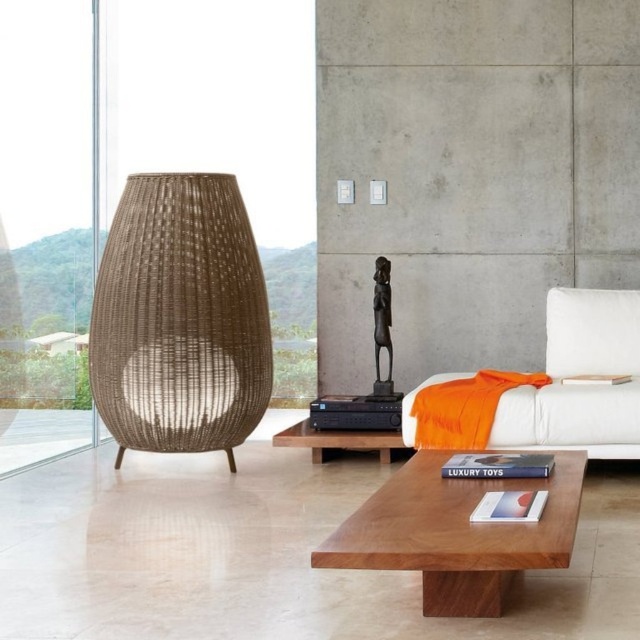
Does transparent glass door at left come behind brown wooden table at center?

Yes, transparent glass door at left is behind brown wooden table at center.

Is transparent glass door at left to the right of brown wooden table at center from the viewer's perspective?

Incorrect, transparent glass door at left is not on the right side of brown wooden table at center.

What do you see at coordinates (45, 225) in the screenshot? This screenshot has height=640, width=640. I see `transparent glass door at left` at bounding box center [45, 225].

Find the location of `transparent glass door at left`. transparent glass door at left is located at coordinates (45, 225).

Is white fabric couch at right shorter than brown woven side table at center?

No.

Is white fabric couch at right positioned at the back of brown woven side table at center?

No, it is in front of brown woven side table at center.

Which is in front, point (582, 413) or point (282, 436)?

Point (582, 413) is in front.

At what (x,y) coordinates should I click in order to perform the action: click on white fabric couch at right. Please return your answer as a coordinate pair (x, y). Image resolution: width=640 pixels, height=640 pixels. Looking at the image, I should click on (580, 381).

Between brown wooden table at center and white fabric pillow at right, which one has more height?

With more height is white fabric pillow at right.

Does brown wooden table at center lie in front of white fabric pillow at right?

Yes.

What do you see at coordinates (458, 532) in the screenshot? I see `brown wooden table at center` at bounding box center [458, 532].

Identify the location of brown wooden table at center. The image size is (640, 640). (458, 532).